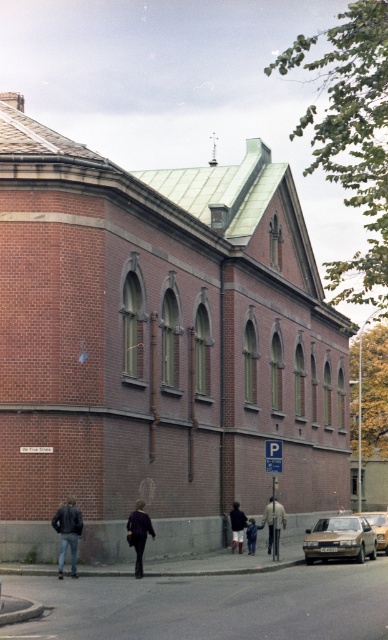
You are a delivery person standing at the entrance of the brick building with a green roof. You need to locate the person wearing a dark purple jacket at center to deliver a package. According to the coordinates provided, where should you look relative to the building?

The dark purple jacket at center is located at coordinates point (138, 532), which means it is positioned towards the upper middle section of the image. Since you are at the entrance of the brick building with a green roof, you should look towards the center area slightly above eye level to find the person wearing the dark purple jacket at center.

You are a photographer standing on the sidewalk in front of the brick building. You want to take a photo that includes both the dark purple jacket at center and the dark blue jeans at lower center. Which object should you focus on first if you want to ensure both are in the frame?

The dark purple jacket at center is much taller than the dark blue jeans at lower center, so you should focus on the dark purple jacket at center first to ensure both are in the frame.

You are a delivery person trying to park your silver metallic car at lower right near the parking sign. There is a pedestrian wearing a light brown leather jacket at center blocking the path. Can you safely maneuver around them without hitting the car?

The light brown leather jacket at center is not as tall as the silver metallic car at lower right, so you can safely maneuver around them as long as you maintain a safe distance. The jacket is shorter than the car, so there should be enough clearance.